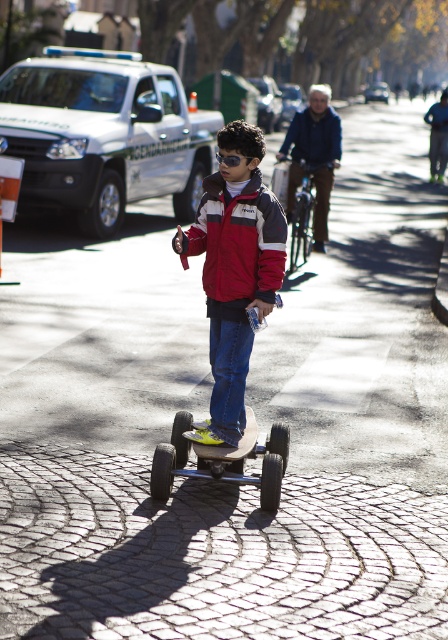
Question: Among these points, which one is nearest to the camera?

Choices:
 (A) (212, 449)
 (B) (281, 442)
 (C) (231, 273)
 (D) (224, 177)

Answer: (D)

Question: Can you confirm if red matte jacket at center is bigger than black rubber skateboard at center?

Choices:
 (A) no
 (B) yes

Answer: (B)

Question: Is red matte jacket at center below metallic silver skateboard at center?

Choices:
 (A) yes
 (B) no

Answer: (B)

Question: Which object is farther from the camera taking this photo?

Choices:
 (A) metallic silver skateboard at center
 (B) black rubber skateboard at center
 (C) red matte jacket at center
 (D) red jacket at center

Answer: (B)

Question: Is red jacket at center behind black rubber skateboard at center?

Choices:
 (A) no
 (B) yes

Answer: (A)

Question: Which point is farther from the camera taking this photo?

Choices:
 (A) (214, 452)
 (B) (253, 234)

Answer: (B)